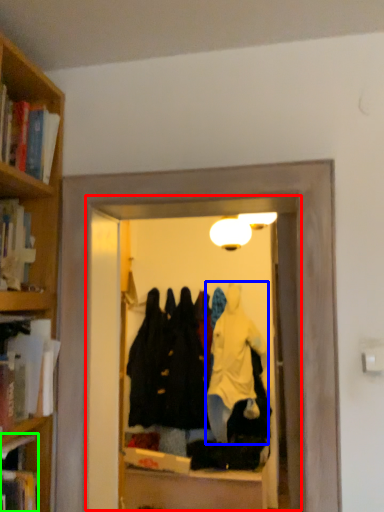
Question: Which object is positioned farthest from glass door (highlighted by a red box)? Select from bathrobe (highlighted by a blue box) and book (highlighted by a green box).

Choices:
 (A) bathrobe
 (B) book

Answer: (B)